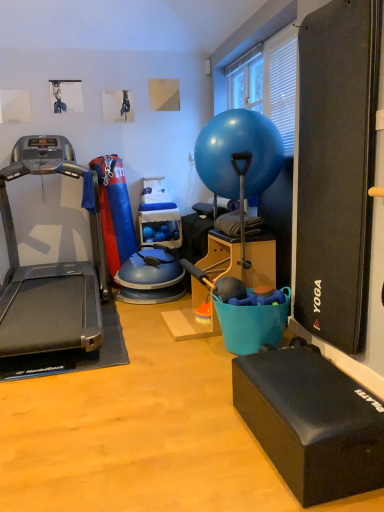
The image size is (384, 512). I want to click on vacant region above black rubber yoga block at lower right, the 2th box positioned from the top (from a real-world perspective), so click(x=306, y=378).